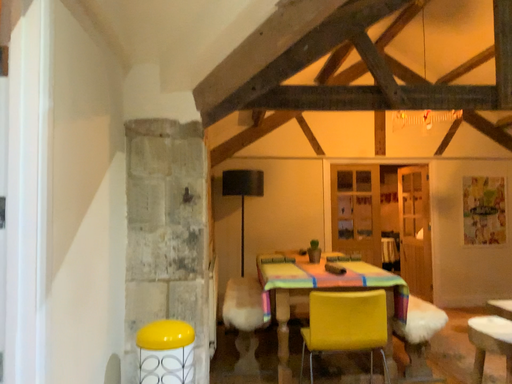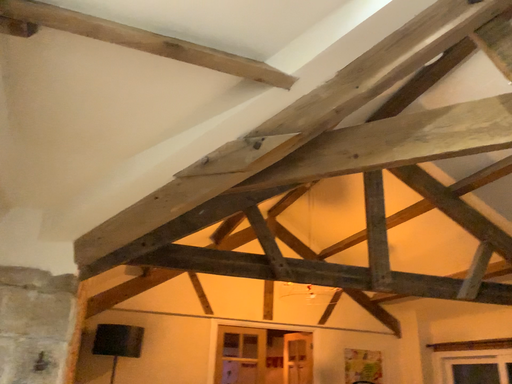
Question: How did the camera likely rotate when shooting the video?

Choices:
 (A) rotated downward
 (B) rotated upward

Answer: (B)